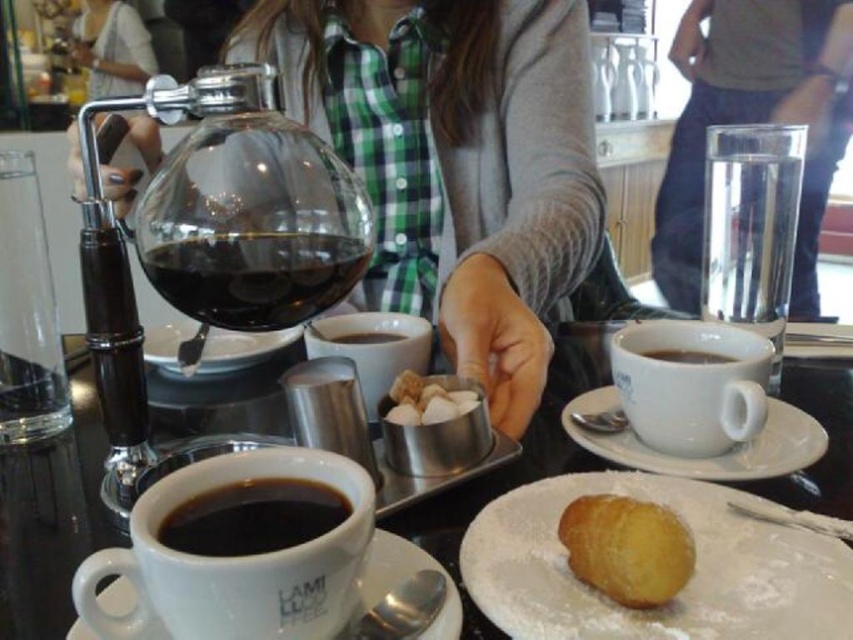
Is matte white cup at center wider than black matte cup at center?

Incorrect, matte white cup at center's width does not surpass black matte cup at center's.

Is point (677, 353) positioned before point (357, 339)?

That is True.

Between point (674, 360) and point (384, 337), which one is positioned in front?

Point (674, 360) is more forward.

You are a GUI agent. You are given a task and a screenshot of the screen. Output one action in this format:
    pyautogui.click(x=<x>, y=<y>)
    Task: Click on the matte white cup at center
    The height and width of the screenshot is (640, 853).
    Given the screenshot: What is the action you would take?
    pyautogui.click(x=688, y=356)

Does white ceramic sugar bowl at center have a lesser height compared to powdery golden donut at lower center?

No.

Can you confirm if white ceramic sugar bowl at center is taller than powdery golden donut at lower center?

Yes.

The height and width of the screenshot is (640, 853). Find the location of `white ceramic sugar bowl at center`. white ceramic sugar bowl at center is located at coordinates (51, 522).

Is point (567, 332) farther from viewer compared to point (425, 403)?

Yes, point (567, 332) is farther from viewer.

Who is shorter, white ceramic sugar bowl at center or white sugar cubes at center?

With less height is white sugar cubes at center.

Who is more forward, (836, 461) or (476, 400)?

Point (836, 461) is more forward.

The height and width of the screenshot is (640, 853). Identify the location of white ceramic sugar bowl at center. (51, 522).